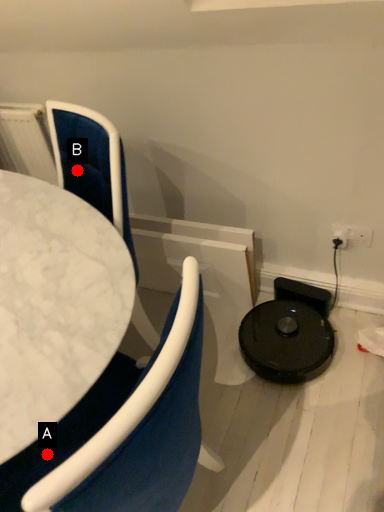
Question: Two points are circled on the image, labeled by A and B beside each circle. Which point appears closest to the camera in this image?

Choices:
 (A) A is closer
 (B) B is closer

Answer: (A)